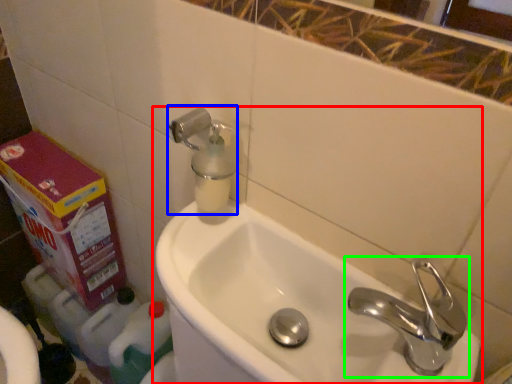
Question: Estimate the real-world distances between objects in this image. Which object is closer to sink (highlighted by a red box), soap dispenser (highlighted by a blue box) or tap (highlighted by a green box)?

Choices:
 (A) soap dispenser
 (B) tap

Answer: (B)